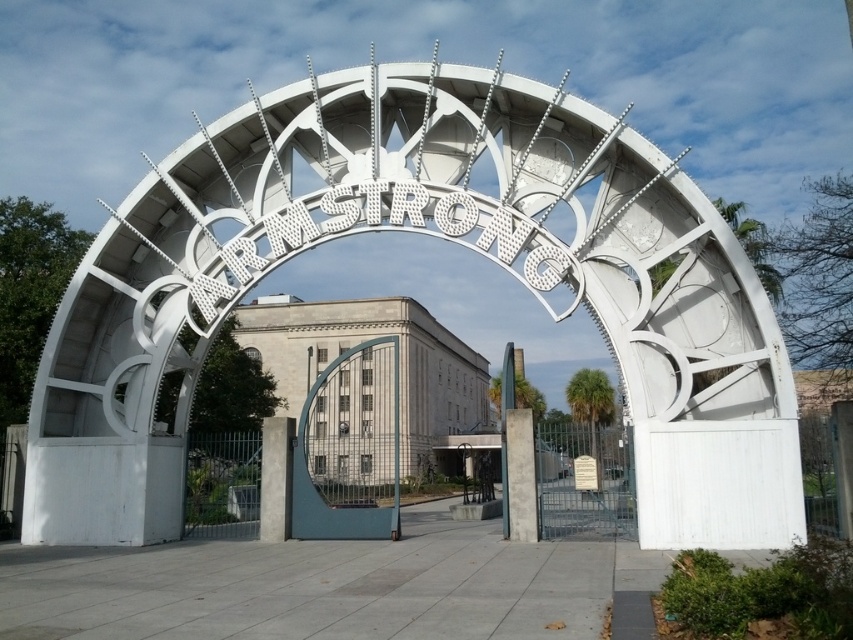
You are standing in front of the gateway structure. There is a point marked at coordinates (x=439, y=237). What object is located at that point?

The point at coordinates (x=439, y=237) indicates the white metallic gate at center.

You are a visitor arriving at the entrance of the building. You see two gates, the white metallic gate at center and the blue metallic gate at center. Which gate is covering the other one?

The white metallic gate at center is positioned over the blue metallic gate at center, so the white metallic gate is covering the blue one.